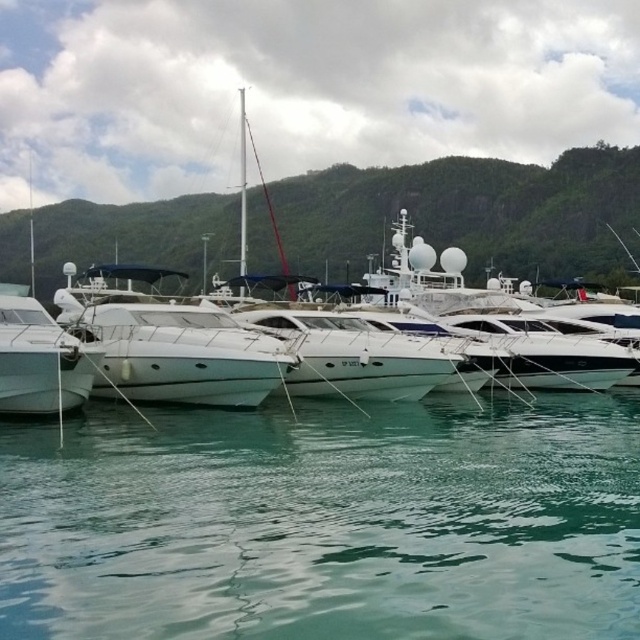
Does green liquid water at lower center appear on the right side of white glossy boat at center?

Indeed, green liquid water at lower center is positioned on the right side of white glossy boat at center.

Is green liquid water at lower center to the left of white glossy boat at center from the viewer's perspective?

In fact, green liquid water at lower center is to the right of white glossy boat at center.

The height and width of the screenshot is (640, 640). What do you see at coordinates (324, 522) in the screenshot?
I see `green liquid water at lower center` at bounding box center [324, 522].

Find the location of a particular element. Image resolution: width=640 pixels, height=640 pixels. green liquid water at lower center is located at coordinates (324, 522).

Is green liquid water at lower center bigger than white glossy boat at left?

Correct, green liquid water at lower center is larger in size than white glossy boat at left.

Can you confirm if green liquid water at lower center is wider than white glossy boat at left?

Yes.

Does point (504, 460) lie in front of point (13, 355)?

Yes, point (504, 460) is in front of point (13, 355).

Where is `green liquid water at lower center`? This screenshot has width=640, height=640. green liquid water at lower center is located at coordinates (324, 522).

Can you confirm if white glossy boat at center is thinner than white glossy boat at left?

No, white glossy boat at center is not thinner than white glossy boat at left.

Is point (141, 314) less distant than point (93, 371)?

No, it is behind (93, 371).

Find the location of a particular element. This screenshot has width=640, height=640. white glossy boat at center is located at coordinates (168, 342).